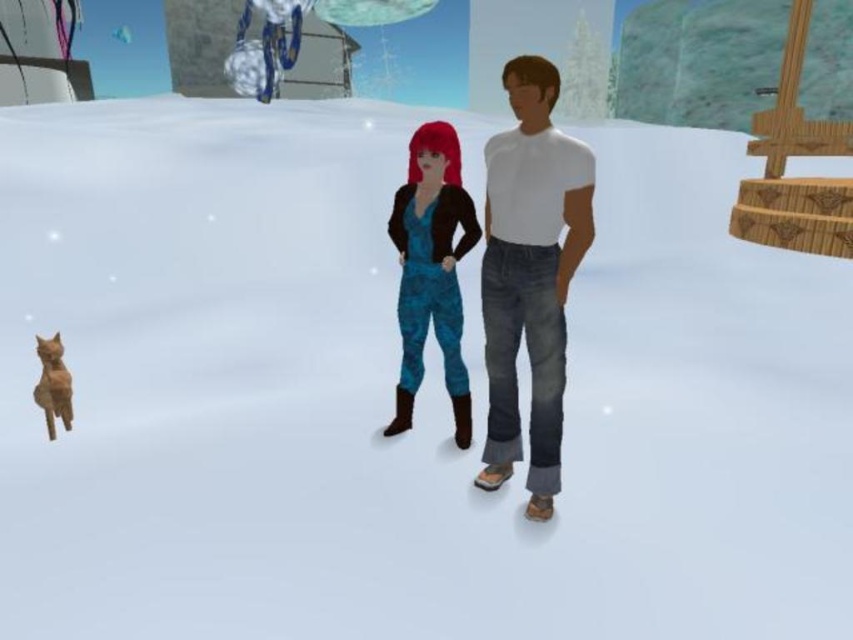
In the scene described, there are a white matte shirt at center and an orange fur cat at lower left. Which object is located higher up in the image?

The white matte shirt at center is positioned over the orange fur cat at lower left, meaning it is higher up in the image.

You are a character in the game who needs to determine the relative sizes of the objects in the scene. Which object is taller between the white matte shirt at center and the orange fur cat at lower left?

The white matte shirt at center is taller than the orange fur cat at lower left according to the description.

You are a photographer positioned at the back of the scene. You want to capture a photo where both the white matte shirt at center and the blue camouflage jumpsuit at center are clearly visible. Based on their heights, which character should you position closer to the camera to ensure both are fully visible in the frame?

The white matte shirt at center is taller than the blue camouflage jumpsuit at center. To ensure both are fully visible, position the shorter blue camouflage jumpsuit at center closer to the camera so its height compensates for the distance, while the taller white matte shirt at center can be slightly farther back.